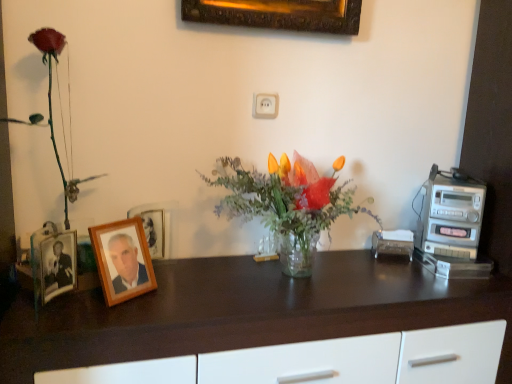
Image resolution: width=512 pixels, height=384 pixels. In order to click on free spot below clear glass vase at center (from a real-world perspective) in this screenshot , I will do click(x=303, y=281).